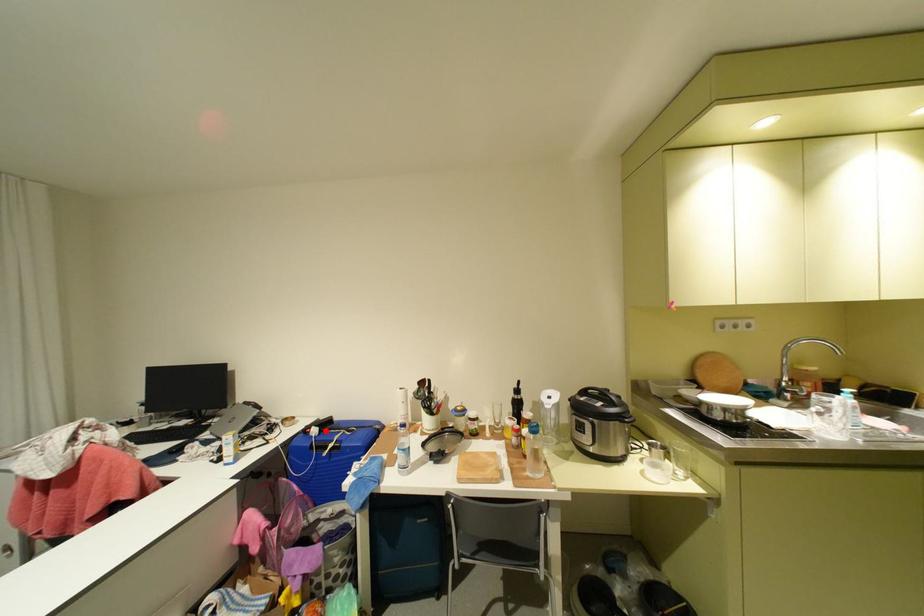
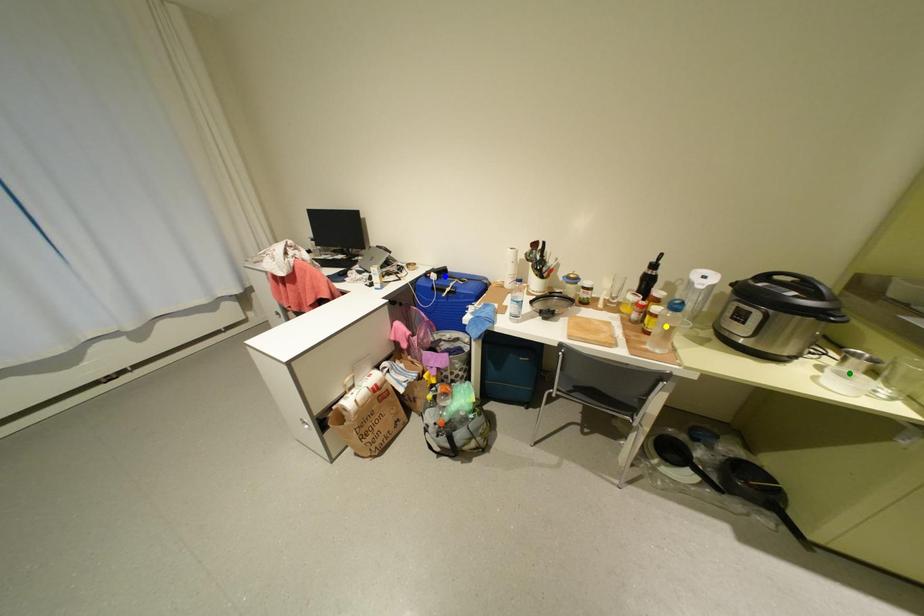
Question: I am providing you with two images of the same scene from different viewpoints. A red point is marked on the first image. You are given multiple points on the second image. Which point in image 2 is actually the same real-world point as the red point in image 1?

Choices:
 (A) blue point
 (B) yellow point
 (C) green point

Answer: (A)